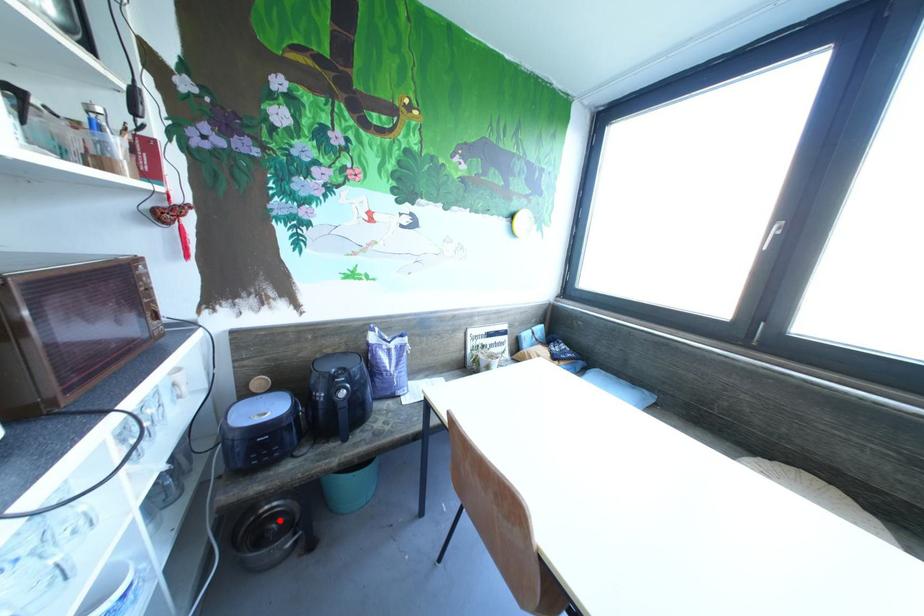
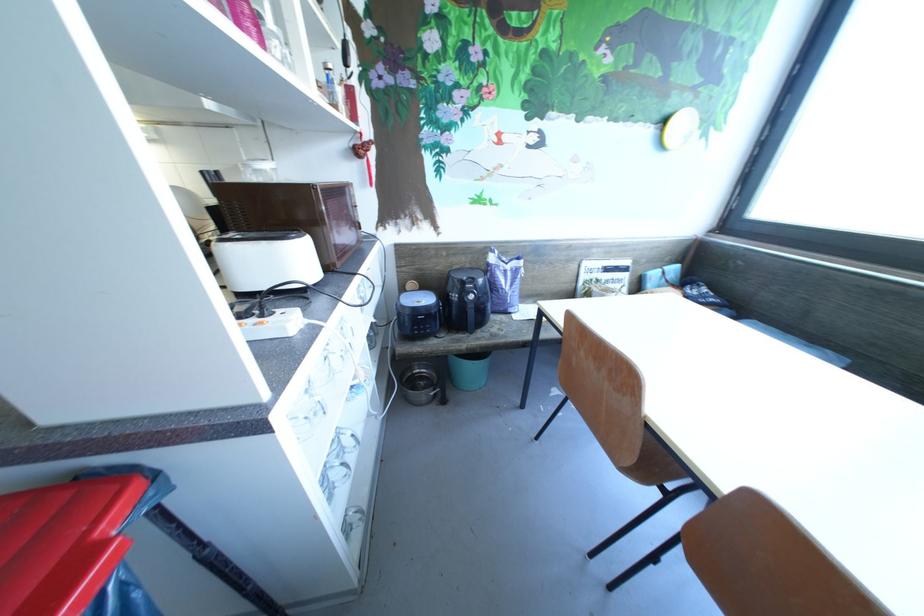
The point at the highlighted location is marked in the first image. Where is the corresponding point in the second image?

(427, 379)